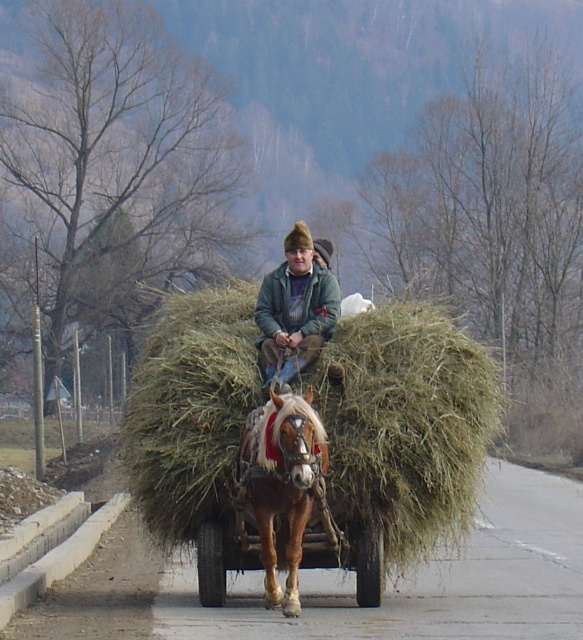
Question: Does brown glossy horse at center have a smaller size compared to green woolen jacket at center?

Choices:
 (A) no
 (B) yes

Answer: (B)

Question: Considering the relative positions of brown glossy horse at center and green woolen jacket at center in the image provided, where is brown glossy horse at center located with respect to green woolen jacket at center?

Choices:
 (A) left
 (B) right

Answer: (A)

Question: Which point is farther to the camera?

Choices:
 (A) (220, 477)
 (B) (310, 410)
 (C) (305, 310)

Answer: (C)

Question: Which point appears closest to the camera in this image?

Choices:
 (A) (314, 276)
 (B) (442, 352)

Answer: (B)

Question: Is brown glossy horse at center bigger than green woolen jacket at center?

Choices:
 (A) no
 (B) yes

Answer: (A)

Question: Which of these objects is positioned farthest from the green grassy hay at center?

Choices:
 (A) brown glossy horse at center
 (B) green woolen jacket at center

Answer: (A)